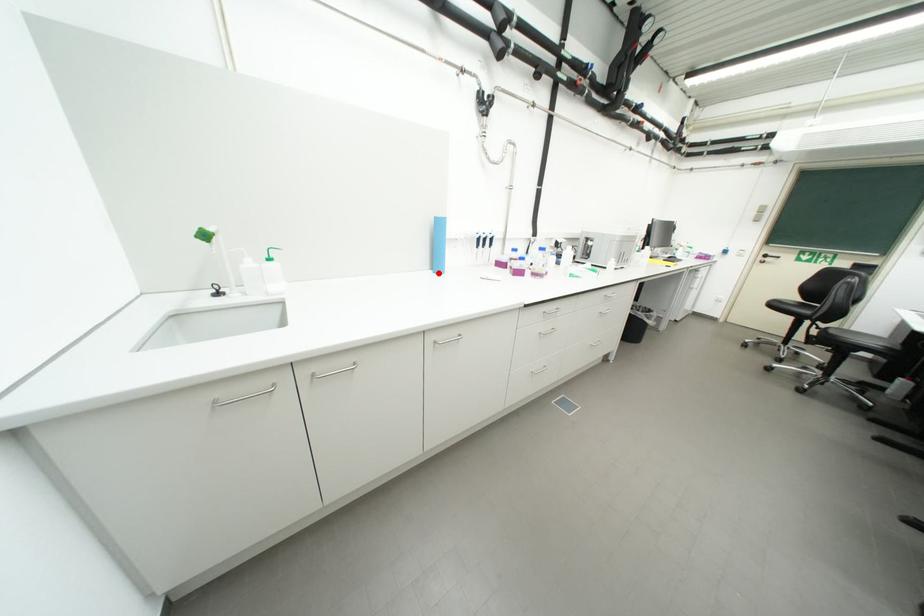
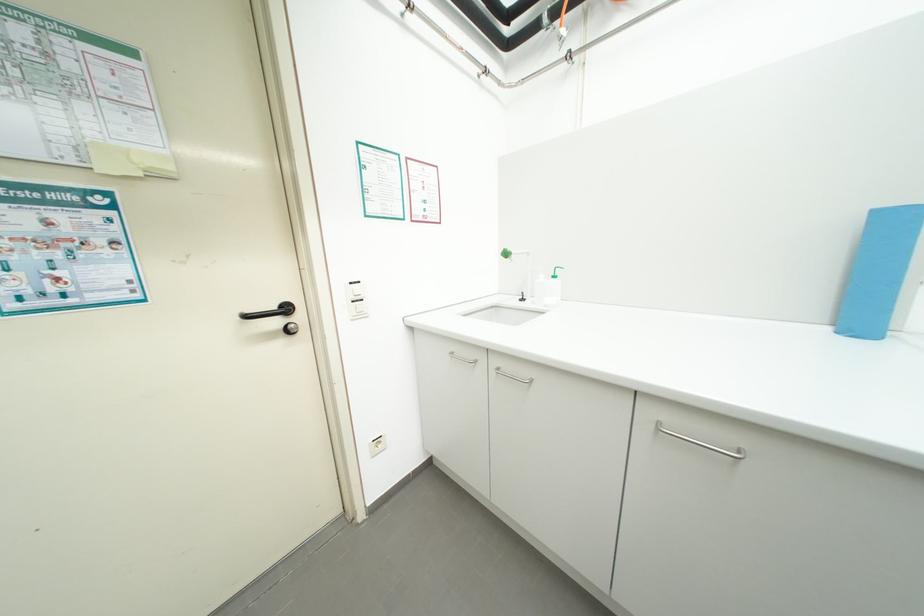
In the second image, find the point that corresponds to the highlighted location in the first image.

(835, 330)